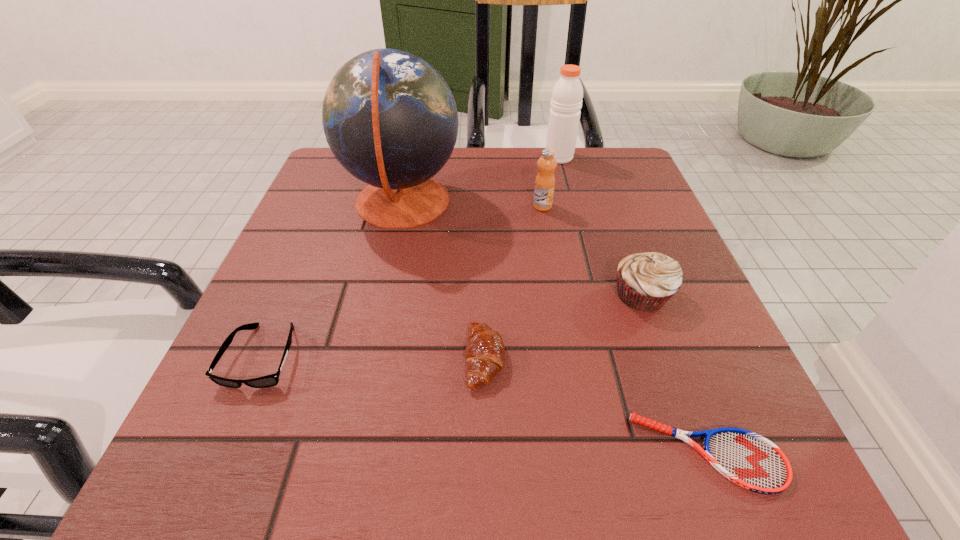
Where is `shaker positioned at the far edge`? This screenshot has width=960, height=540. shaker positioned at the far edge is located at coordinates (566, 101).

Where is `orange juice located at the far edge`? orange juice located at the far edge is located at coordinates (545, 180).

Image resolution: width=960 pixels, height=540 pixels. I want to click on object present at the near edge, so click(748, 459).

You are a GUI agent. You are given a task and a screenshot of the screen. Output one action in this format:
    pyautogui.click(x=<x>, y=<y>)
    Task: Click on the globe that is at the left edge
    
    Given the screenshot: What is the action you would take?
    pyautogui.click(x=390, y=119)

Locate an element on the screen. sunglasses that is at the left edge is located at coordinates (271, 380).

Find the location of a particular element. shaker at the right edge is located at coordinates (566, 101).

Locate an element on the screen. This screenshot has width=960, height=540. muffin located in the right edge section of the desktop is located at coordinates (645, 281).

Locate an element on the screen. This screenshot has height=540, width=960. tennis racket present at the right edge is located at coordinates (748, 459).

Image resolution: width=960 pixels, height=540 pixels. In order to click on object present at the far left corner in this screenshot , I will do `click(390, 119)`.

Locate an element on the screen. object that is at the far right corner is located at coordinates 566,101.